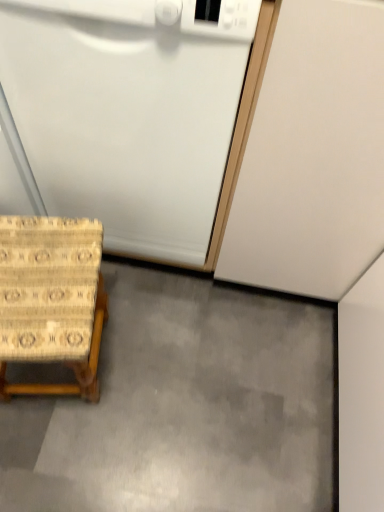
Locate an element on the screen. The height and width of the screenshot is (512, 384). free spot to the right of beige woven stool at lower left is located at coordinates (159, 370).